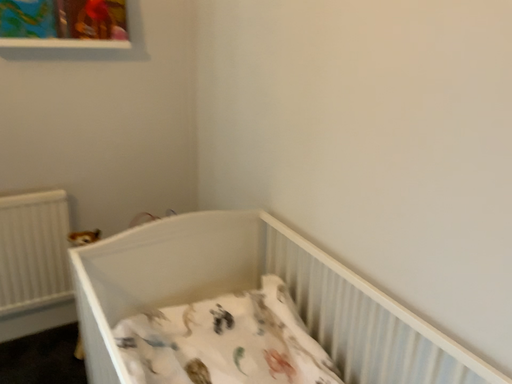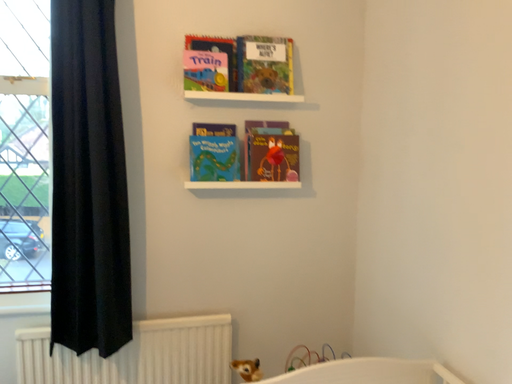
Question: How did the camera likely rotate when shooting the video?

Choices:
 (A) rotated downward
 (B) rotated upward

Answer: (B)